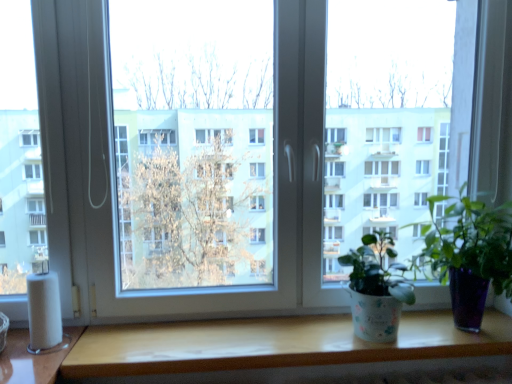
Question: From the image's perspective, is green glossy plant at center, positioned as the 1th houseplant in right-to-left order, located beneath white matte toilet paper at lower left?

Choices:
 (A) no
 (B) yes

Answer: (A)

Question: Would you say green glossy plant at center, positioned as the 1th houseplant in right-to-left order, contains white matte toilet paper at lower left?

Choices:
 (A) yes
 (B) no

Answer: (B)

Question: Is green glossy plant at center, which is the second houseplant in left-to-right order, completely or partially outside of white matte toilet paper at lower left?

Choices:
 (A) no
 (B) yes

Answer: (B)

Question: Is green glossy plant at center, which is the second houseplant in left-to-right order, to the left of white matte toilet paper at lower left from the viewer's perspective?

Choices:
 (A) yes
 (B) no

Answer: (B)

Question: Considering the relative sizes of green glossy plant at center, which is the second houseplant in left-to-right order, and white matte toilet paper at lower left in the image provided, is green glossy plant at center, which is the second houseplant in left-to-right order, smaller than white matte toilet paper at lower left?

Choices:
 (A) no
 (B) yes

Answer: (A)

Question: From the image's perspective, is white textured pot at center, which ranks as the first houseplant in left-to-right order, positioned above or below green glossy plant at center, which is the second houseplant in left-to-right order?

Choices:
 (A) above
 (B) below

Answer: (B)

Question: From a real-world perspective, relative to green glossy plant at center, which is the second houseplant in left-to-right order, is white textured pot at center, the 2th houseplant from the right, vertically above or below?

Choices:
 (A) above
 (B) below

Answer: (B)

Question: Considering the positions of point (381, 263) and point (460, 278), is point (381, 263) closer or farther from the camera than point (460, 278)?

Choices:
 (A) closer
 (B) farther

Answer: (B)

Question: In the image, is white textured pot at center, the 2th houseplant from the right, on the left side or the right side of green glossy plant at center, which is the second houseplant in left-to-right order?

Choices:
 (A) left
 (B) right

Answer: (A)

Question: In terms of size, does wooden table at lower center appear bigger or smaller than green glossy plant at center, which is the second houseplant in left-to-right order?

Choices:
 (A) big
 (B) small

Answer: (B)

Question: Considering the positions of point (138, 326) and point (454, 304), is point (138, 326) closer or farther from the camera than point (454, 304)?

Choices:
 (A) farther
 (B) closer

Answer: (A)

Question: Is wooden table at lower center in front of or behind green glossy plant at center, positioned as the 1th houseplant in right-to-left order, in the image?

Choices:
 (A) behind
 (B) front

Answer: (A)

Question: Is wooden table at lower center to the left or to the right of green glossy plant at center, positioned as the 1th houseplant in right-to-left order, in the image?

Choices:
 (A) left
 (B) right

Answer: (A)

Question: Is white matte toilet paper at lower left to the left or to the right of green glossy plant at center, positioned as the 1th houseplant in right-to-left order, in the image?

Choices:
 (A) left
 (B) right

Answer: (A)

Question: Do you think white matte toilet paper at lower left is within green glossy plant at center, which is the second houseplant in left-to-right order, or outside of it?

Choices:
 (A) outside
 (B) inside

Answer: (A)